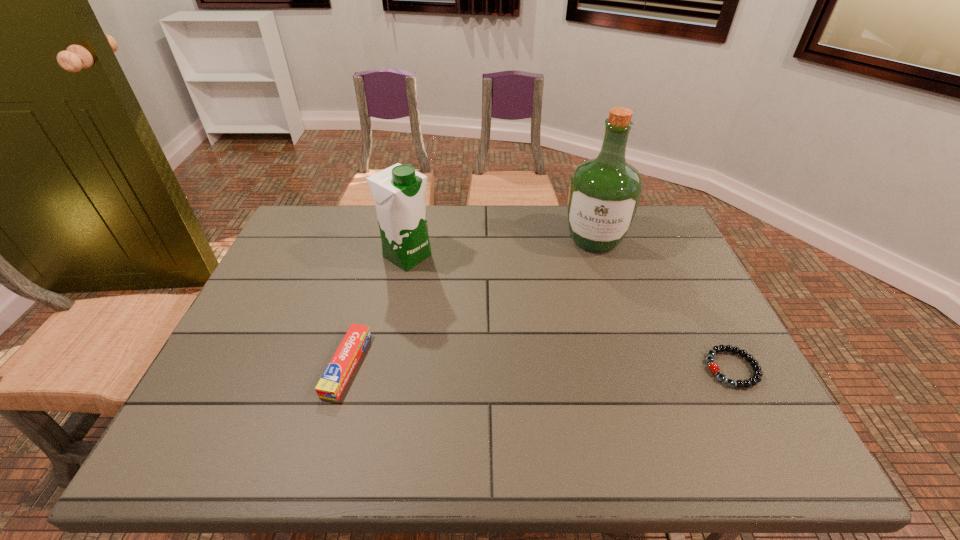
The height and width of the screenshot is (540, 960). I want to click on vacant space on the desktop that is between the third tallest object and the rightmost object and is positioned on the front-facing side of the second tallest object, so click(586, 367).

At what (x,y) coordinates should I click in order to perform the action: click on free spot on the desktop that is between the third tallest object and the rightmost object and is positioned on the front-facing side of the tallest object. Please return your answer as a coordinate pair (x, y). Looking at the image, I should click on (575, 367).